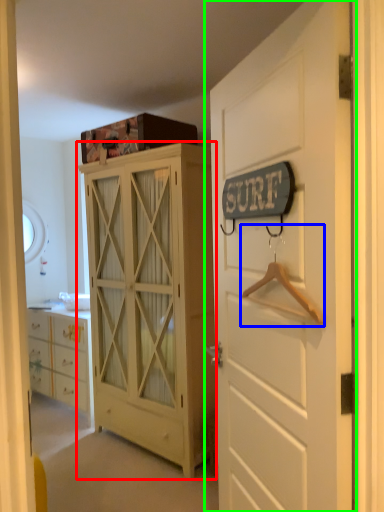
Question: Based on their relative distances, which object is nearer to cabinetry (highlighted by a red box)? Choose from hanger (highlighted by a blue box) and door (highlighted by a green box).

Choices:
 (A) hanger
 (B) door

Answer: (B)